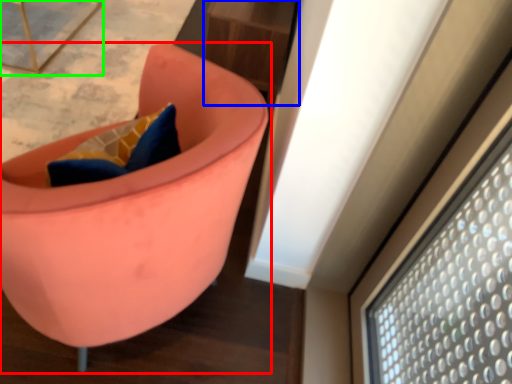
Question: Which is nearer to the chair (highlighted by a red box)? table (highlighted by a blue box) or furniture (highlighted by a green box).

Choices:
 (A) table
 (B) furniture

Answer: (A)